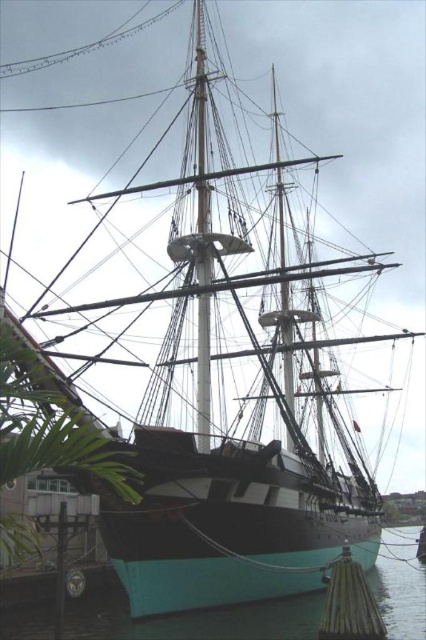
Question: Is teal glossy water at lower center to the left of green bamboo dock at lower right from the viewer's perspective?

Choices:
 (A) yes
 (B) no

Answer: (A)

Question: Which object is closer to the camera taking this photo?

Choices:
 (A) teal glossy water at lower center
 (B) green bamboo dock at lower right

Answer: (A)

Question: Is teal glossy water at lower center closer to the viewer compared to green bamboo dock at lower right?

Choices:
 (A) yes
 (B) no

Answer: (A)

Question: Which object is closer to the camera taking this photo?

Choices:
 (A) green bamboo dock at lower right
 (B) teal glossy water at lower center

Answer: (B)

Question: Which object is closer to the camera taking this photo?

Choices:
 (A) teal glossy water at lower center
 (B) green bamboo dock at lower right

Answer: (A)

Question: Is teal glossy water at lower center below green bamboo dock at lower right?

Choices:
 (A) yes
 (B) no

Answer: (A)